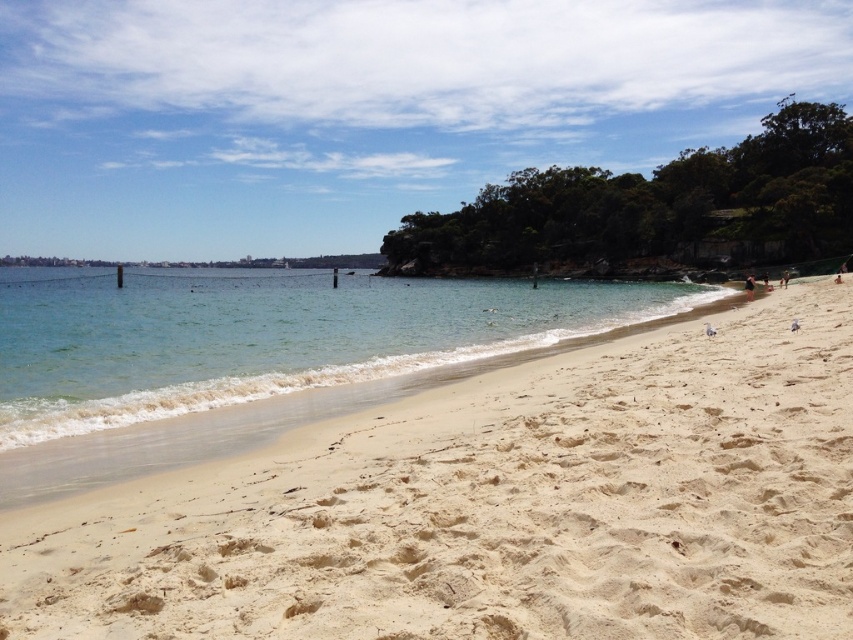
You are standing on the beach and want to take a photo of the black fabric person at lower right and the light brown sand at upper right. Which object will appear wider in the photo?

The black fabric person at lower right will appear wider in the photo because its width is larger than the light brown sand at upper right.

You are planning to build a sandcastle on the beach. You need a wider area to construct a large base. Based on the scene, which sand area should you choose between the light beige sand at lower center and the light brown sand at upper right?

The light beige sand at lower center might be wider than light brown sand at upper right, so it would be a better choice for building a sandcastle with a large base.

Looking at this image, you are standing on the beach and want to take a photo of both the light beige sand at lower center and the clear water at beach center. Which object will appear larger in the photo?

The light beige sand at lower center will appear larger in the photo because it is closer to the viewer than the clear water at beach center.